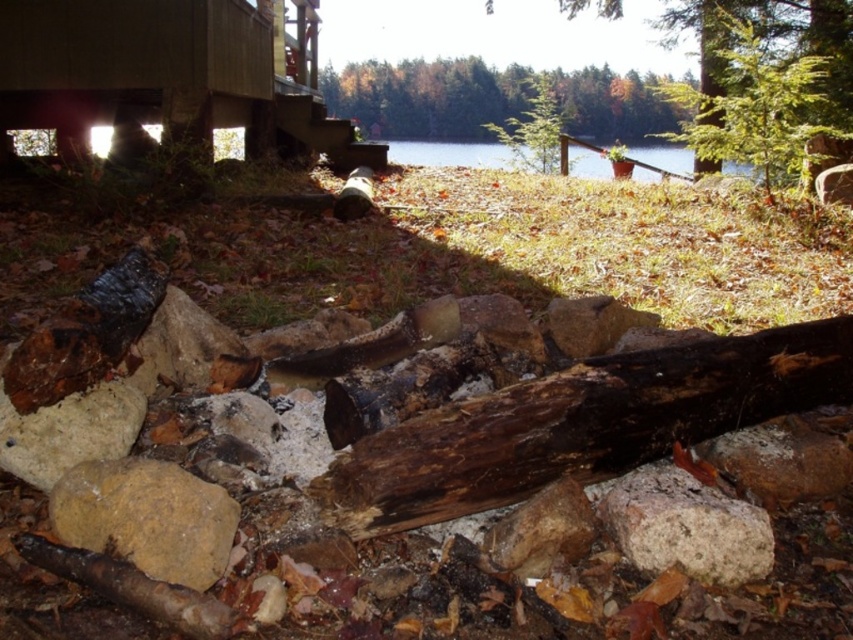
Question: Is green leafy tree at upper right wider than speckled brown rock at center?

Choices:
 (A) yes
 (B) no

Answer: (A)

Question: Based on their relative distances, which object is nearer to the green leafy tree at upper center?

Choices:
 (A) white rough rock at lower left
 (B) clear water at upper center
 (C) yellowish rock at center
 (D) speckled brown rock at center

Answer: (B)

Question: Is white rough rock at lower left in front of clear water at upper center?

Choices:
 (A) no
 (B) yes

Answer: (B)

Question: Which object is the farthest from the white rough rock at lower left?

Choices:
 (A) clear water at upper center
 (B) green leafy tree at upper center
 (C) yellowish rock at center

Answer: (B)

Question: Estimate the real-world distances between objects in this image. Which object is closer to the clear water at upper center?

Choices:
 (A) white rough rock at lower left
 (B) speckled brown rock at center
 (C) green leafy tree at upper center

Answer: (C)

Question: Considering the relative positions of green leafy tree at upper center and yellowish rock at center in the image provided, where is green leafy tree at upper center located with respect to yellowish rock at center?

Choices:
 (A) left
 (B) right

Answer: (B)